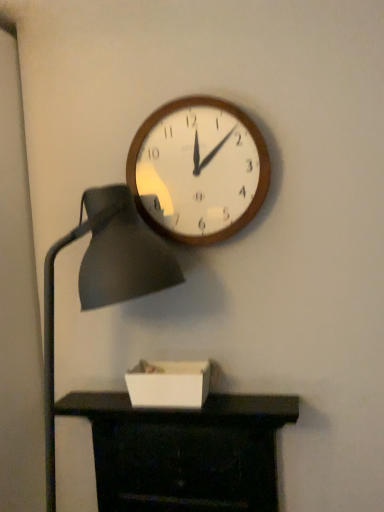
I want to click on free location to the right of white matte box at lower center, so click(x=235, y=398).